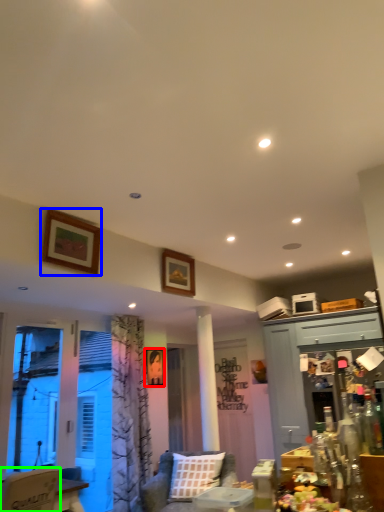
Question: Which object is the farthest from picture frame (highlighted by a red box)? Choose among these: picture frame (highlighted by a blue box) or chair (highlighted by a green box).

Choices:
 (A) picture frame
 (B) chair

Answer: (B)